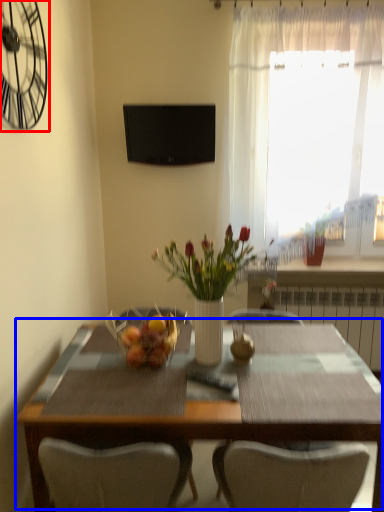
Question: Which of the following is the closest to the observer, clock (highlighted by a red box) or table (highlighted by a blue box)?

Choices:
 (A) clock
 (B) table

Answer: (A)